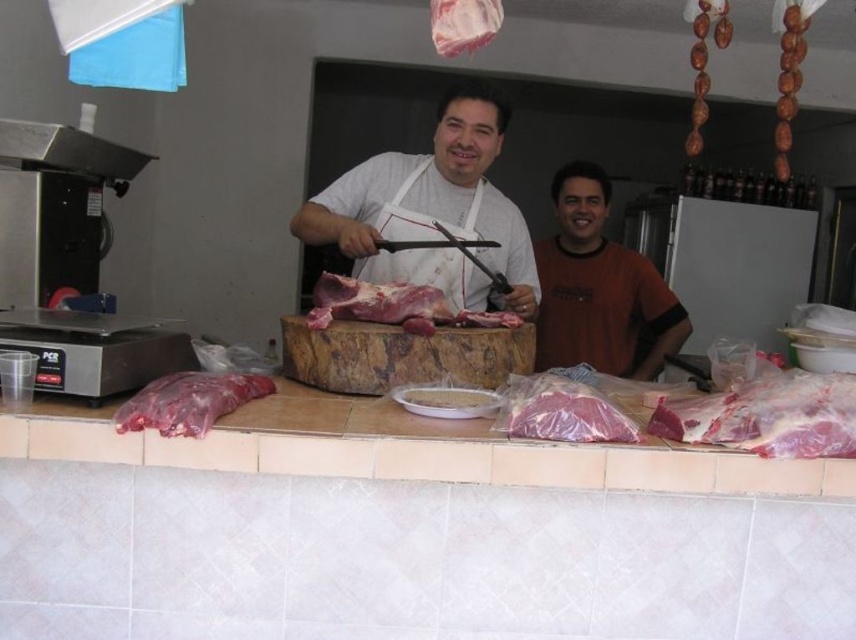
Question: Estimate the real-world distances between objects in this image. Which object is farther from the white plastic plate at center?

Choices:
 (A) translucent plastic bags at lower center
 (B) pinkish raw meat at right

Answer: (B)

Question: Is brown cotton shirt at center wider than raw pink meat at center?

Choices:
 (A) yes
 (B) no

Answer: (A)

Question: Can you confirm if brown cotton shirt at center is smaller than metallic silver exhaust hood at upper left?

Choices:
 (A) yes
 (B) no

Answer: (B)

Question: Does translucent plastic bags at lower center appear over white matte apron at center?

Choices:
 (A) yes
 (B) no

Answer: (B)

Question: Which is nearer to the translucent plastic bags at lower center?

Choices:
 (A) raw red meat at lower left
 (B) brown cotton shirt at center
 (C) raw pink meat at center
 (D) white plastic plate at center

Answer: (A)

Question: Which is farther from the pinkish translucent meat at center?

Choices:
 (A) raw red meat at lower left
 (B) white matte apron at center

Answer: (B)